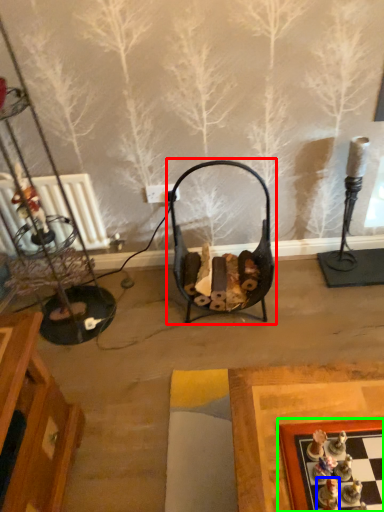
Question: Considering the real-world distances, which object is closest to swivel chair (highlighted by a red box)? toy (highlighted by a blue box) or board game (highlighted by a green box).

Choices:
 (A) toy
 (B) board game

Answer: (B)